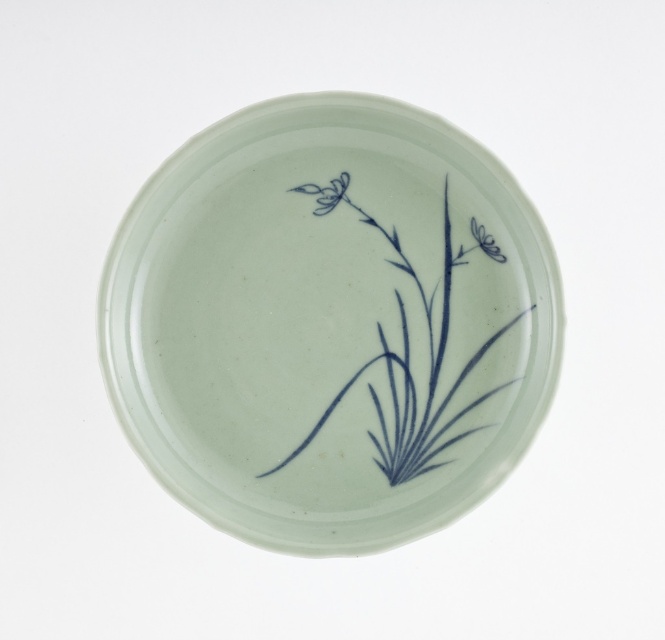
Question: Estimate the real-world distances between objects in this image. Which object is closer to the blue glossy flower at upper left?

Choices:
 (A) blue ink plant at center
 (B) lustre porcelain plate at center
 (C) blue porcelain flower at center

Answer: (A)

Question: Which object is farther from the camera taking this photo?

Choices:
 (A) blue ink plant at center
 (B) blue glossy flower at upper left

Answer: (B)

Question: Can you confirm if blue glossy flower at upper left is wider than blue porcelain flower at center?

Choices:
 (A) no
 (B) yes

Answer: (B)

Question: Can you confirm if lustre porcelain plate at center is positioned to the left of blue porcelain flower at center?

Choices:
 (A) no
 (B) yes

Answer: (B)

Question: Is lustre porcelain plate at center smaller than blue porcelain flower at center?

Choices:
 (A) no
 (B) yes

Answer: (A)

Question: Estimate the real-world distances between objects in this image. Which object is closer to the lustre porcelain plate at center?

Choices:
 (A) blue ink plant at center
 (B) blue glossy flower at upper left
 (C) blue porcelain flower at center

Answer: (A)